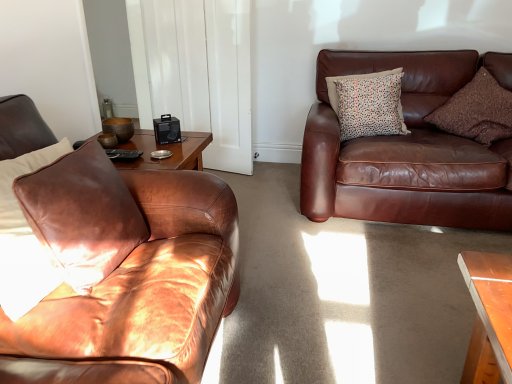
What do you see at coordinates (126, 274) in the screenshot?
I see `matte brown leather couch at left, marked as the 2th studio couch in a back-to-front arrangement` at bounding box center [126, 274].

What do you see at coordinates (368, 104) in the screenshot?
I see `multicolored dotted cushion at upper right, the 3th pillow viewed from the front` at bounding box center [368, 104].

Locate an element on the screen. Image resolution: width=512 pixels, height=384 pixels. brown leather pillow at left, marked as the third pillow in a right-to-left arrangement is located at coordinates (82, 215).

Considering the sizes of objects brown textured pillow at upper right, which ranks as the second pillow in back-to-front order, and white glossy door at upper center in the image provided, who is shorter, brown textured pillow at upper right, which ranks as the second pillow in back-to-front order, or white glossy door at upper center?

Standing shorter between the two is brown textured pillow at upper right, which ranks as the second pillow in back-to-front order.

Is point (504, 122) farther from viewer compared to point (185, 9)?

No.

Looking at this image, is brown textured pillow at upper right, the 2th pillow from the front, looking in the opposite direction of white glossy door at upper center?

No, brown textured pillow at upper right, the 2th pillow from the front,'s orientation is not away from white glossy door at upper center.

Is white glossy door at upper center oriented away from brown leather pillow at left, which is the 3th pillow from back to front?

white glossy door at upper center is not turned away from brown leather pillow at left, which is the 3th pillow from back to front.

Considering the positions of objects white glossy door at upper center and brown leather pillow at left, marked as the third pillow in a right-to-left arrangement, in the image provided, who is more to the left, white glossy door at upper center or brown leather pillow at left, marked as the third pillow in a right-to-left arrangement,?

Positioned to the left is brown leather pillow at left, marked as the third pillow in a right-to-left arrangement.

Considering the relative sizes of white glossy door at upper center and brown leather pillow at left, marked as the third pillow in a right-to-left arrangement, in the image provided, is white glossy door at upper center wider than brown leather pillow at left, marked as the third pillow in a right-to-left arrangement,?

No.

From a real-world perspective, is white glossy door at upper center located higher than brown leather pillow at left, the first pillow from the front?

Yes, from a real-world perspective, white glossy door at upper center is on top of brown leather pillow at left, the first pillow from the front.

Is brown leather couch at right, which is counted as the first studio couch, starting from the back, directly adjacent to multicolored dotted cushion at upper right, the 3th pillow viewed from the front?

No, brown leather couch at right, which is counted as the first studio couch, starting from the back, is not next to multicolored dotted cushion at upper right, the 3th pillow viewed from the front.

The width and height of the screenshot is (512, 384). What are the coordinates of `pillow that is the 2nd object located behind the brown leather couch at right, the second studio couch viewed from the front` in the screenshot? It's located at (368, 104).

Looking at this image, can we say brown leather couch at right, the first studio couch from the right, lies outside multicolored dotted cushion at upper right, positioned as the first pillow in back-to-front order?

Yes, brown leather couch at right, the first studio couch from the right, is not within multicolored dotted cushion at upper right, positioned as the first pillow in back-to-front order.

Does point (468, 205) come in front of point (361, 102)?

That is True.

Would you say brown textured pillow at upper right, the 2th pillow from the front, contains multicolored dotted cushion at upper right, positioned as the first pillow in back-to-front order?

No, multicolored dotted cushion at upper right, positioned as the first pillow in back-to-front order, is not surrounded by brown textured pillow at upper right, the 2th pillow from the front.

Is brown textured pillow at upper right, the first pillow in the right-to-left sequence, positioned far away from multicolored dotted cushion at upper right, positioned as the first pillow in back-to-front order?

brown textured pillow at upper right, the first pillow in the right-to-left sequence, is actually quite close to multicolored dotted cushion at upper right, positioned as the first pillow in back-to-front order.

Which point is more forward, [452,109] or [360,121]?

The point [360,121] is more forward.

Is brown textured pillow at upper right, the 2th pillow from the front, in front of multicolored dotted cushion at upper right, positioned as the first pillow in back-to-front order?

Yes, the depth of brown textured pillow at upper right, the 2th pillow from the front, is less than that of multicolored dotted cushion at upper right, positioned as the first pillow in back-to-front order.

Is brown leather pillow at left, marked as the third pillow in a right-to-left arrangement, oriented away from matte brown leather couch at left, positioned as the 1th studio couch in left-to-right order?

Yes, brown leather pillow at left, marked as the third pillow in a right-to-left arrangement,'s orientation is away from matte brown leather couch at left, positioned as the 1th studio couch in left-to-right order.

Is brown leather pillow at left, marked as the first pillow in a left-to-right arrangement, far from matte brown leather couch at left, marked as the 2th studio couch in a back-to-front arrangement?

That's not correct — brown leather pillow at left, marked as the first pillow in a left-to-right arrangement, is a little close to matte brown leather couch at left, marked as the 2th studio couch in a back-to-front arrangement.

Is point (95, 215) farther from camera compared to point (192, 204)?

No, it is in front of (192, 204).

From a real-world perspective, which is physically above, brown leather pillow at left, marked as the first pillow in a left-to-right arrangement, or white glossy door at upper center?

From a 3D spatial view, white glossy door at upper center is above.

What are the coordinates of `glass door above the brown leather pillow at left, marked as the first pillow in a left-to-right arrangement (from a real-world perspective)` in the screenshot? It's located at (196, 72).

Which is closer, (73,266) or (229,134)?

Point (73,266).

Can you confirm if brown leather pillow at left, marked as the third pillow in a right-to-left arrangement, is smaller than white glossy door at upper center?

Yes.

From a real-world perspective, is brown textured pillow at upper right, the first pillow in the right-to-left sequence, physically above brown leather couch at right, the first studio couch from the right?

Yes, from a real-world perspective, brown textured pillow at upper right, the first pillow in the right-to-left sequence, is on top of brown leather couch at right, the first studio couch from the right.

Can you tell me how much brown textured pillow at upper right, which is the 3th pillow in left-to-right order, and brown leather couch at right, the first studio couch from the right, differ in facing direction?

A: There is a 6.34-degree angle between the facing directions of brown textured pillow at upper right, which is the 3th pillow in left-to-right order, and brown leather couch at right, the first studio couch from the right.

Could you tell me if brown textured pillow at upper right, which is the 3th pillow in left-to-right order, is turned towards brown leather couch at right, which is counted as the first studio couch, starting from the back?

Yes, brown textured pillow at upper right, which is the 3th pillow in left-to-right order, is oriented towards brown leather couch at right, which is counted as the first studio couch, starting from the back.

Based on the photo, is brown textured pillow at upper right, the 2th pillow from the front, smaller than brown leather couch at right, which is counted as the first studio couch, starting from the back?

Yes.

At what (x,y) coordinates should I click in order to perform the action: click on the 2nd pillow to the right when counting from the white glossy door at upper center. Please return your answer as a coordinate pair (x, y). The image size is (512, 384). Looking at the image, I should click on (476, 111).

I want to click on glass door located above the brown leather pillow at left, marked as the third pillow in a right-to-left arrangement (from a real-world perspective), so click(x=196, y=72).

Considering their positions, is brown textured pillow at upper right, the 2th pillow from the front, positioned closer to white glossy door at upper center than brown leather pillow at left, the first pillow from the front?

Among the two, brown textured pillow at upper right, the 2th pillow from the front, is located nearer to white glossy door at upper center.

Which object lies nearer to the anchor point multicolored dotted cushion at upper right, which is the second pillow from right to left, matte brown leather couch at left, which is the first studio couch from front to back, or white glossy door at upper center?

Based on the image, white glossy door at upper center appears to be nearer to multicolored dotted cushion at upper right, which is the second pillow from right to left.

Based on their spatial positions, is brown leather couch at right, the second studio couch when ordered from left to right, or matte brown leather couch at left, positioned as the 1th studio couch in left-to-right order, further from multicolored dotted cushion at upper right, positioned as the first pillow in back-to-front order?

Among the two, matte brown leather couch at left, positioned as the 1th studio couch in left-to-right order, is located further to multicolored dotted cushion at upper right, positioned as the first pillow in back-to-front order.

Based on the photo, from the image, which object appears to be farther from multicolored dotted cushion at upper right, the 3th pillow viewed from the front, brown textured pillow at upper right, which ranks as the second pillow in back-to-front order, or white glossy door at upper center?

The object further to multicolored dotted cushion at upper right, the 3th pillow viewed from the front, is white glossy door at upper center.

From the picture: Estimate the real-world distances between objects in this image. Which object is further from multicolored dotted cushion at upper right, the 3th pillow viewed from the front, white glossy door at upper center or matte brown leather couch at left, the 2th studio couch in the right-to-left sequence?

matte brown leather couch at left, the 2th studio couch in the right-to-left sequence, is positioned further to the anchor multicolored dotted cushion at upper right, the 3th pillow viewed from the front.

Estimate the real-world distances between objects in this image. Which object is further from brown textured pillow at upper right, the 2th pillow from the front, brown leather pillow at left, marked as the first pillow in a left-to-right arrangement, or white glossy door at upper center?

brown leather pillow at left, marked as the first pillow in a left-to-right arrangement.

From the image, which object appears to be farther from matte brown leather couch at left, marked as the 2th studio couch in a back-to-front arrangement, brown leather couch at right, the second studio couch viewed from the front, or multicolored dotted cushion at upper right, the 3th pillow viewed from the front?

Based on the image, multicolored dotted cushion at upper right, the 3th pillow viewed from the front, appears to be further to matte brown leather couch at left, marked as the 2th studio couch in a back-to-front arrangement.

From the picture: When comparing their distances from brown leather couch at right, the first studio couch from the right, does multicolored dotted cushion at upper right, which is the second pillow from right to left, or brown textured pillow at upper right, the first pillow in the right-to-left sequence, seem further?

Among the two, brown textured pillow at upper right, the first pillow in the right-to-left sequence, is located further to brown leather couch at right, the first studio couch from the right.

This screenshot has height=384, width=512. In order to click on glass door between brown leather pillow at left, marked as the third pillow in a right-to-left arrangement, and brown leather couch at right, the first studio couch from the right, from left to right in this screenshot , I will do `click(196, 72)`.

Find the location of `pillow situated between white glossy door at upper center and brown leather couch at right, the second studio couch viewed from the front, from left to right`. pillow situated between white glossy door at upper center and brown leather couch at right, the second studio couch viewed from the front, from left to right is located at coordinates (368, 104).

Find the location of a particular element. studio couch between brown leather pillow at left, marked as the third pillow in a right-to-left arrangement, and brown textured pillow at upper right, the first pillow in the right-to-left sequence is located at coordinates (407, 149).

Identify the location of pillow between brown leather pillow at left, marked as the third pillow in a right-to-left arrangement, and brown textured pillow at upper right, which is the 3th pillow in left-to-right order, in the horizontal direction. The height and width of the screenshot is (384, 512). (368, 104).